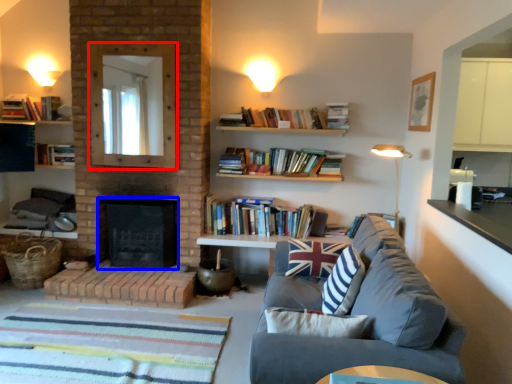
Question: Which object is closer to the camera taking this photo, mirror (highlighted by a red box) or fireplace (highlighted by a blue box)?

Choices:
 (A) mirror
 (B) fireplace

Answer: (A)